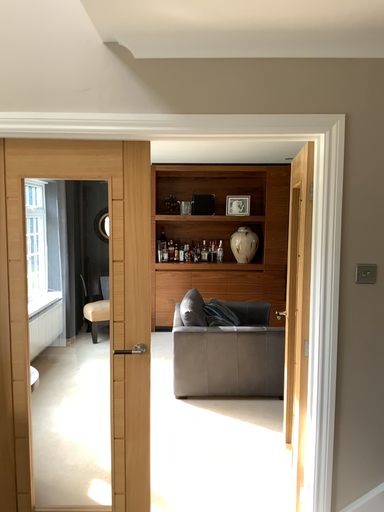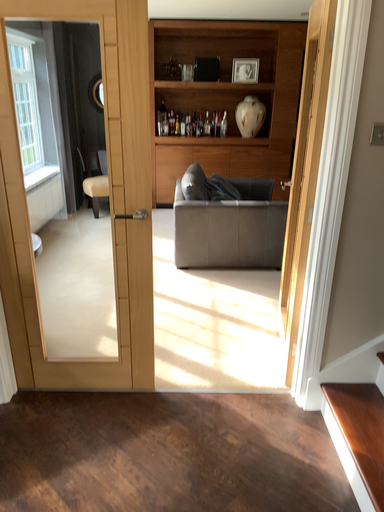
Question: Which way did the camera rotate in the video?

Choices:
 (A) rotated upward
 (B) rotated downward

Answer: (B)